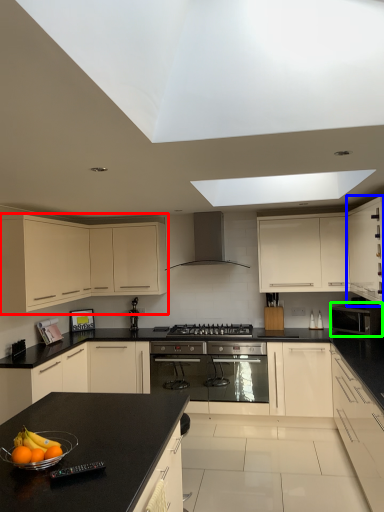
Question: Which is nearer to the cabinetry (highlighted by a red box)? cabinetry (highlighted by a blue box) or kitchen appliance (highlighted by a green box).

Choices:
 (A) cabinetry
 (B) kitchen appliance

Answer: (A)